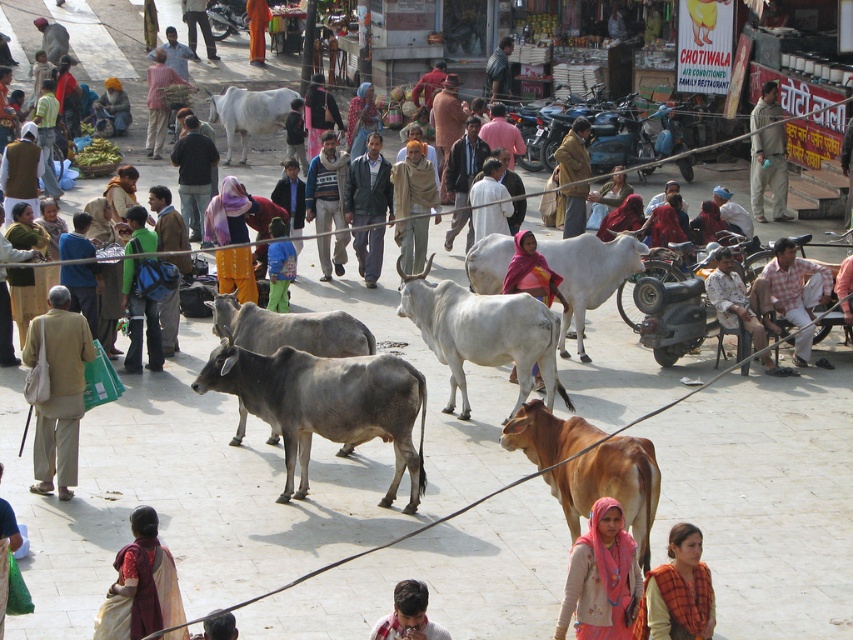
Question: Does white glossy bull at center lie behind orange fabric pants at center?

Choices:
 (A) yes
 (B) no

Answer: (B)

Question: Estimate the real-world distances between objects in this image. Which object is farther from the blue fabric pants at center?

Choices:
 (A) gray matte bull at center
 (B) knitted sweater at center
 (C) green fabric backpack at center

Answer: (A)

Question: Can you confirm if gray smooth bull at center is positioned to the left of light brown fabric at center?

Choices:
 (A) no
 (B) yes

Answer: (B)

Question: Among these points, which one is nearest to the camera?

Choices:
 (A) (795, 372)
 (B) (636, 636)
 (C) (440, 630)
 (D) (228, 92)

Answer: (C)

Question: From the image, what is the correct spatial relationship of beige fabric bag at lower left in relation to pink fabric headscarf at center?

Choices:
 (A) right
 (B) left

Answer: (B)

Question: Which object is closer to the camera taking this photo?

Choices:
 (A) brown fabric jacket at center
 (B) white cow at center

Answer: (B)